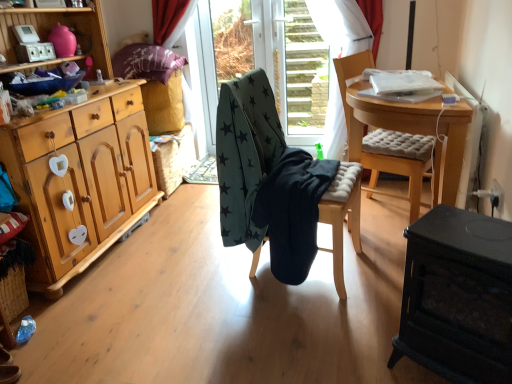
Find the location of a particular element. The image size is (512, 384). vacant space in front of teal star-patterned fabric at center, marked as the 2th chair in a right-to-left arrangement is located at coordinates (306, 330).